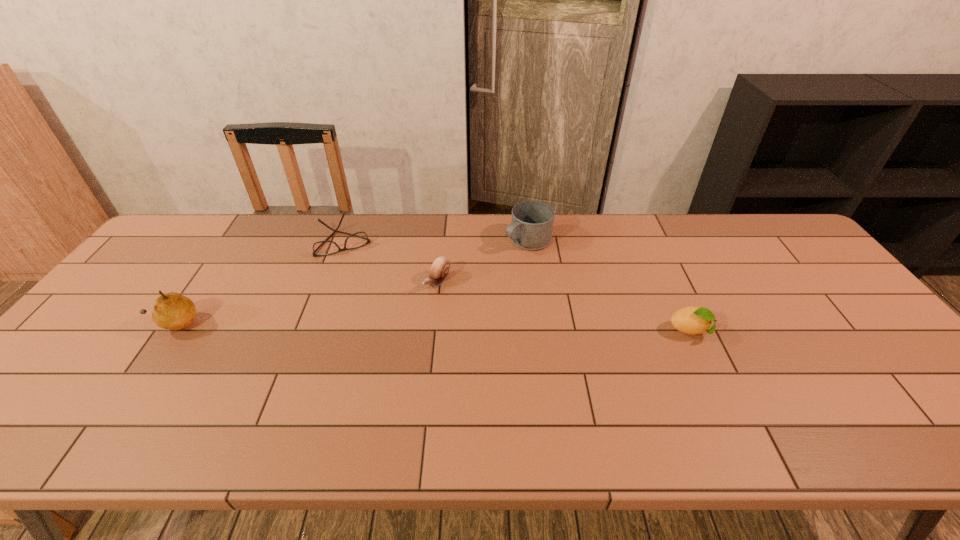
Where is `spectacles that is at the far edge`? spectacles that is at the far edge is located at coordinates (322, 248).

Find the location of a particular element. The width and height of the screenshot is (960, 540). object that is at the left edge is located at coordinates (172, 311).

Find the location of a particular element. vacant space at the far edge of the desktop is located at coordinates (270, 224).

The width and height of the screenshot is (960, 540). In the image, there is a desktop. Find the location of `vacant space at the near edge`. vacant space at the near edge is located at coordinates (160, 386).

Locate an element on the screen. The height and width of the screenshot is (540, 960). free space at the left edge of the desktop is located at coordinates (131, 285).

This screenshot has width=960, height=540. Identify the location of free space at the right edge of the desktop. (840, 345).

Locate an element on the screen. vacant space at the far right corner of the desktop is located at coordinates (753, 230).

Where is `vacant region between the spectacles and the third object from right to left`? Image resolution: width=960 pixels, height=540 pixels. vacant region between the spectacles and the third object from right to left is located at coordinates (391, 261).

You are a GUI agent. You are given a task and a screenshot of the screen. Output one action in this format:
    pyautogui.click(x=<x>, y=<y>)
    Task: Click on the vacant space in between the third object from left to right and the fourth shortest object
    
    Given the screenshot: What is the action you would take?
    pyautogui.click(x=482, y=261)

What are the coordinates of `empty location between the third farthest object and the lemon` in the screenshot? It's located at (564, 307).